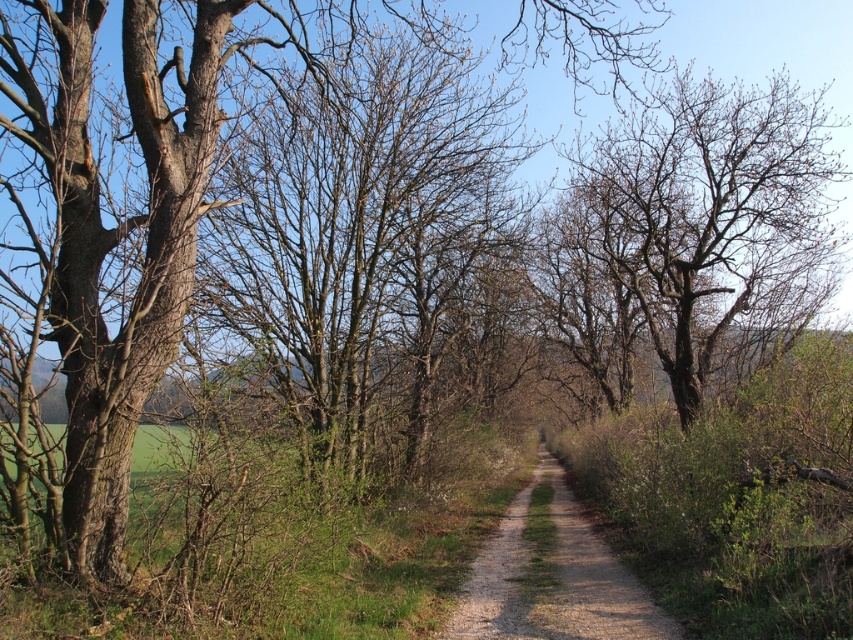
You are standing at the starting point of the path in the scene. Which direction should you walk to reach the brown bark tree at center?

Since the brown bark tree at center is located at coordinates point (106, 234), you should walk towards the center of the image to reach it.